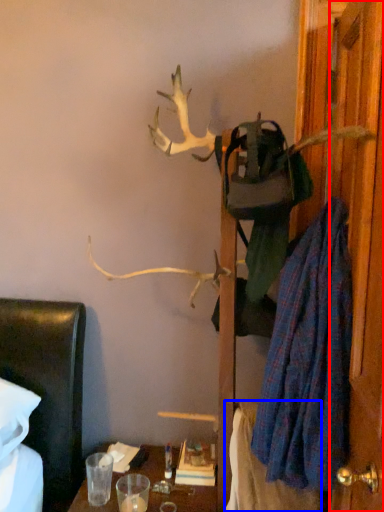
Question: Which of the following is the farthest to the observer, door (highlighted by a red box) or blanket (highlighted by a blue box)?

Choices:
 (A) door
 (B) blanket

Answer: (B)